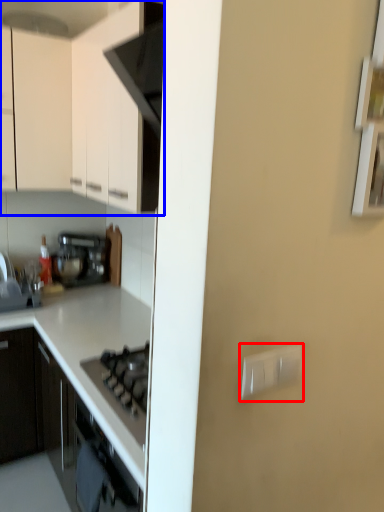
Question: Which object is closer to the camera taking this photo, electric outlet (highlighted by a red box) or cabinetry (highlighted by a blue box)?

Choices:
 (A) electric outlet
 (B) cabinetry

Answer: (A)